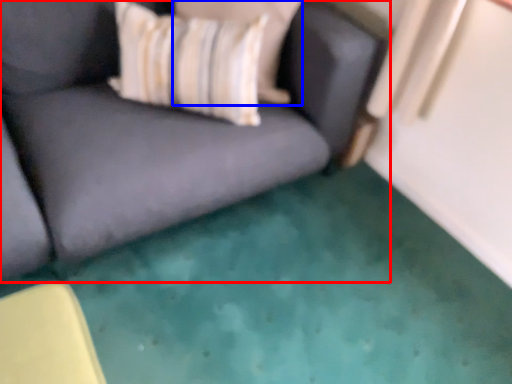
Question: Which object appears closest to the camera in this image, studio couch (highlighted by a red box) or pillow (highlighted by a blue box)?

Choices:
 (A) studio couch
 (B) pillow

Answer: (A)